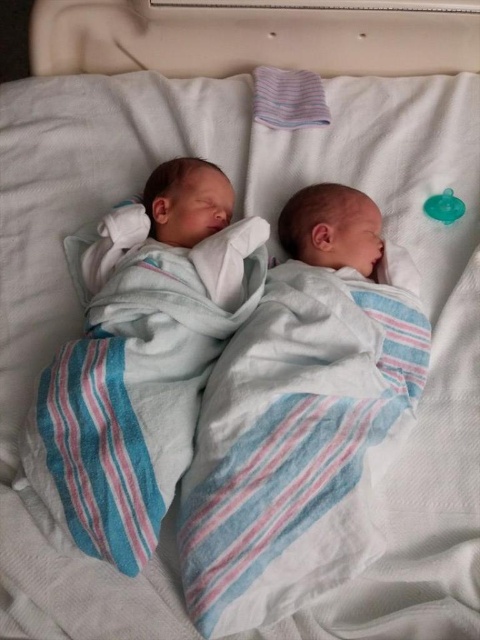
You are a nurse in a hospital nursery. You need to place a new baby in the exact same position as the white striped swaddle at center. According to the coordinates provided, where should you place the new baby?

The white striped swaddle at center is located at coordinates point (x=300, y=417), so you should place the new baby at the same coordinates point (x=300, y=417).

You are a nurse in a hospital nursery and need to place a small medical kit between the white striped swaddle at center and the white cotton swaddle at center. The kit is 5 inches long. Will it fit between them?

The distance between the white striped swaddle at center and the white cotton swaddle at center is 4.84 inches. Since the medical kit is 5 inches long, it will not fit between them as it is slightly longer than the available space.

You are a nurse in a hospital nursery. You need to choose a swaddle to wrap a newborn baby who needs extra warmth. The taller swaddle is better for warmth. Which swaddle should you choose between the white striped swaddle at center and the white cotton swaddle at center?

The white striped swaddle at center is taller than the white cotton swaddle at center, so the nurse should choose the white striped swaddle at center because it provides better warmth.